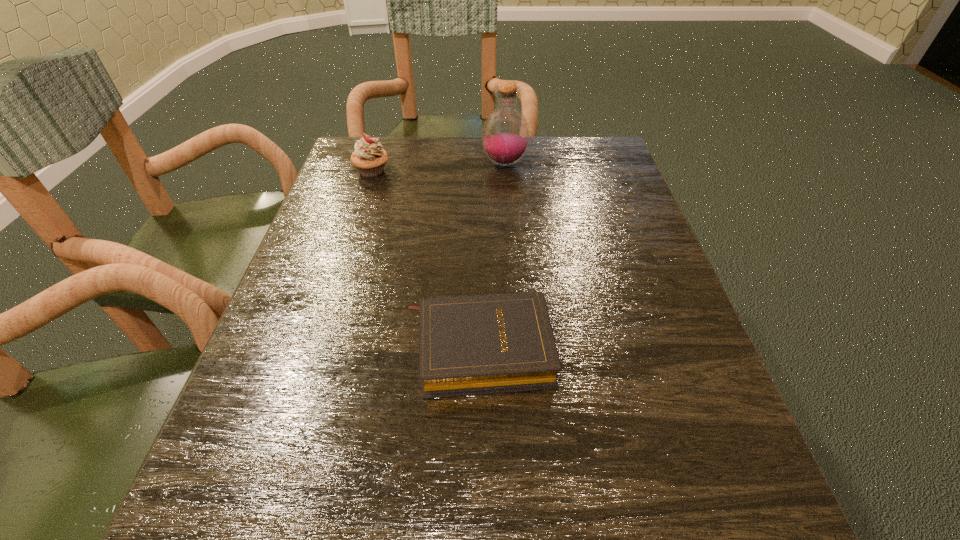
The width and height of the screenshot is (960, 540). In order to click on object that is at the left edge in this screenshot , I will do `click(369, 158)`.

You are a GUI agent. You are given a task and a screenshot of the screen. Output one action in this format:
    pyautogui.click(x=<x>, y=<y>)
    Task: Click on the object present at the far left corner
    
    Given the screenshot: What is the action you would take?
    (x=369, y=158)

This screenshot has width=960, height=540. What are the coordinates of `vacant space at the far edge of the desktop` in the screenshot? It's located at (497, 166).

Identify the location of blank space at the left edge. (354, 229).

This screenshot has width=960, height=540. I want to click on free space at the right edge of the desktop, so click(710, 467).

In the image, there is a desktop. Where is `vacant space at the far right corner`? This screenshot has width=960, height=540. vacant space at the far right corner is located at coordinates (624, 166).

At what (x,y) coordinates should I click in order to perform the action: click on vacant space at the near right corner. Please return your answer as a coordinate pair (x, y). The height and width of the screenshot is (540, 960). Looking at the image, I should click on (724, 517).

You are a GUI agent. You are given a task and a screenshot of the screen. Output one action in this format:
    pyautogui.click(x=<x>, y=<y>)
    Task: Click on the free space that is in between the cupcake and the Bible
    
    Given the screenshot: What is the action you would take?
    pyautogui.click(x=425, y=260)

You are a GUI agent. You are given a task and a screenshot of the screen. Output one action in this format:
    pyautogui.click(x=<x>, y=<y>)
    Task: Click on the vacant area between the cupcake and the Bible
    
    Given the screenshot: What is the action you would take?
    pyautogui.click(x=425, y=260)

Locate an element on the screen. The width and height of the screenshot is (960, 540). free spot between the cupcake and the bottle is located at coordinates (439, 167).